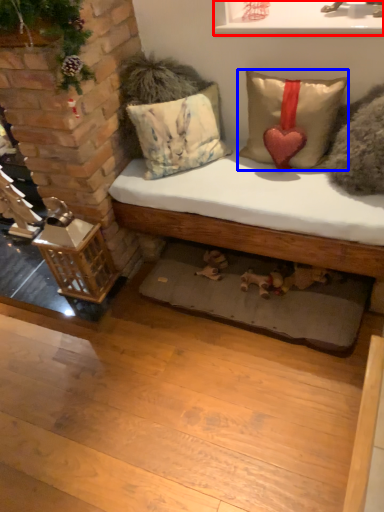
Question: Which object is further to the camera taking this photo, window sill (highlighted by a red box) or pillow (highlighted by a blue box)?

Choices:
 (A) window sill
 (B) pillow

Answer: (B)